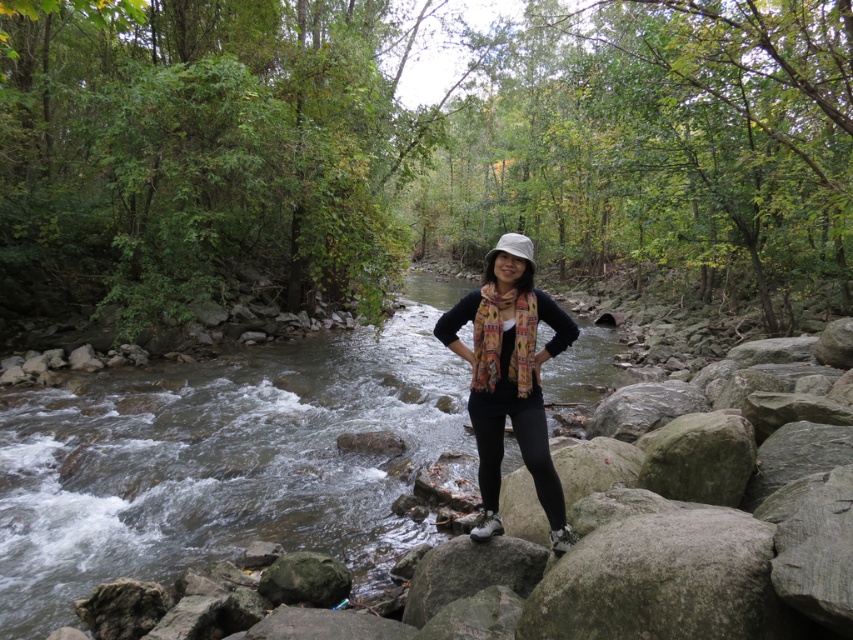
You are a photographer planning to take a photo of the black matte scarf at center while standing on the rocky outcrop. Since the clear water at stream center is in the way, can you adjust your position to capture the scarf without the water obstructing the view?

The clear water at stream center is above the black matte scarf at center, so if you lower your camera angle or move to a lower position on the rocky outcrop, you can capture the scarf without the water blocking the view.

You are taking a photo of the stream and want to ensure both the person and the frothy rapids are in focus. The person is at point (181, 500) and the rapids are at point (548, 500). Since both points share the same x coordinate, which one is closer to the camera and should be prioritized for focus?

Point (181, 500) is further to the camera than point (548, 500). Therefore, the rapids at point (548, 500) are closer to the camera and should be prioritized for focus to ensure sharpness.

You are a photographer trying to capture the black matte scarf at center and the clear water at stream center in a single shot. Can you focus on both objects simultaneously?

The black matte scarf at center is behind the clear water at stream center, so focusing on both simultaneously may be challenging due to their different distances from the camera.